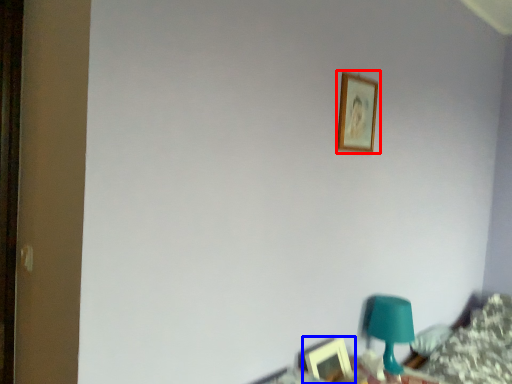
Question: Which object appears closest to the camera in this image, picture frame (highlighted by a red box) or picture frame (highlighted by a blue box)?

Choices:
 (A) picture frame
 (B) picture frame

Answer: (B)